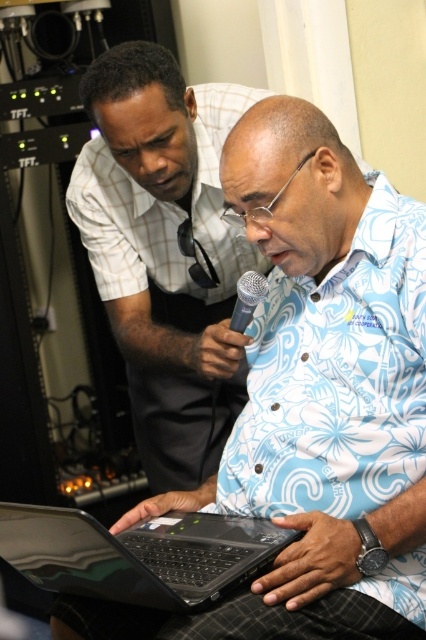
Question: Among these objects, which one is farthest from the camera?

Choices:
 (A) black matte microphone at center
 (B) blue floral shirt at center

Answer: (B)

Question: Does black matte laptop at center appear on the left side of black matte microphone at center?

Choices:
 (A) no
 (B) yes

Answer: (B)

Question: Among these objects, which one is farthest from the camera?

Choices:
 (A) black matte laptop at center
 (B) blue floral shirt at center
 (C) black matte microphone at center

Answer: (B)

Question: Does blue floral shirt at center appear on the left side of black matte microphone at center?

Choices:
 (A) no
 (B) yes

Answer: (B)

Question: In this image, where is blue floral shirt at center located relative to black matte microphone at center?

Choices:
 (A) below
 (B) above

Answer: (B)

Question: Which of the following is the closest to the observer?

Choices:
 (A) (x=109, y=556)
 (B) (x=189, y=365)

Answer: (A)